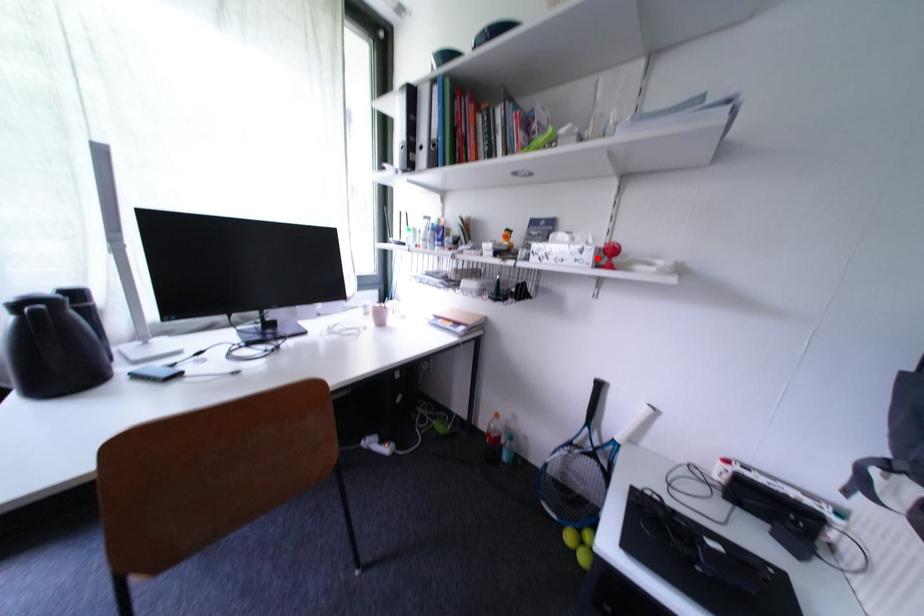
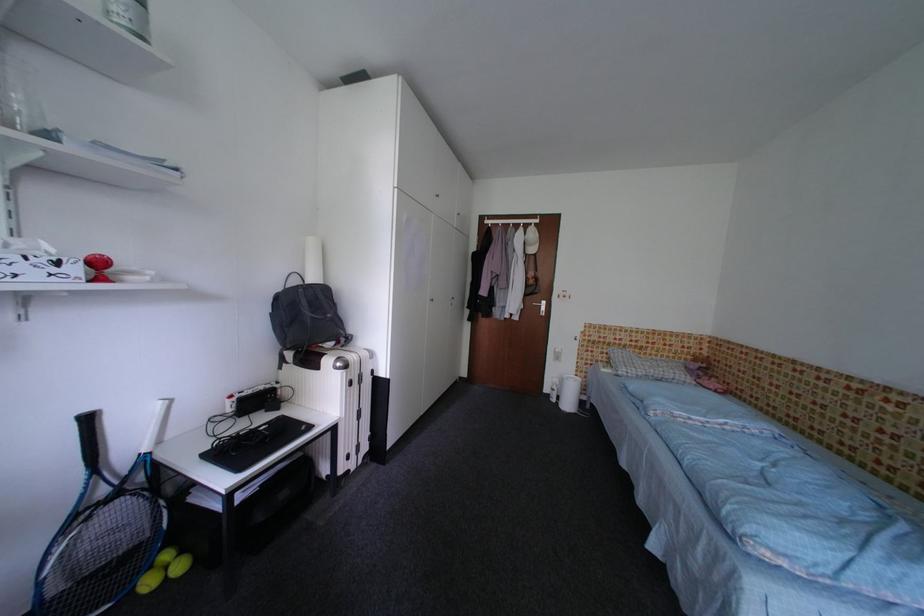
Locate, in the second image, the point that corresponds to the highlighted location in the first image.

(83, 272)